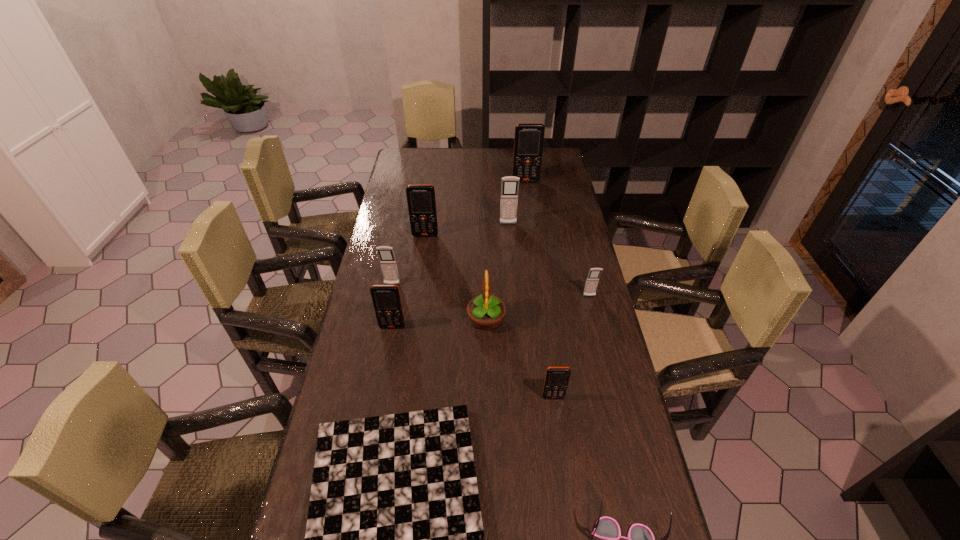
Image resolution: width=960 pixels, height=540 pixels. In order to click on the tallest cellular telephone in this screenshot , I will do `click(528, 143)`.

This screenshot has height=540, width=960. I want to click on the farthest orange cellular telephone, so click(x=528, y=143).

The image size is (960, 540). In order to click on the second farthest object in this screenshot , I will do `click(510, 184)`.

Find the location of a particular element. This screenshot has width=960, height=540. the biggest gray cellular telephone is located at coordinates (510, 184).

Where is `the fifth nearest cellular telephone`? The width and height of the screenshot is (960, 540). the fifth nearest cellular telephone is located at coordinates (421, 200).

You are a GUI agent. You are given a task and a screenshot of the screen. Output one action in this format:
    pyautogui.click(x=<x>, y=<y>)
    Task: Click on the second biggest orange cellular telephone
    The image size is (960, 540).
    Given the screenshot: What is the action you would take?
    pyautogui.click(x=421, y=200)

The image size is (960, 540). Identify the location of sunflower. (486, 311).

Where is `the fourth farthest cellular telephone`? the fourth farthest cellular telephone is located at coordinates (386, 255).

In order to click on the leftmost gray cellular telephone in this screenshot , I will do `click(386, 255)`.

Identify the location of the second nearest cellular telephone. The height and width of the screenshot is (540, 960). (386, 299).